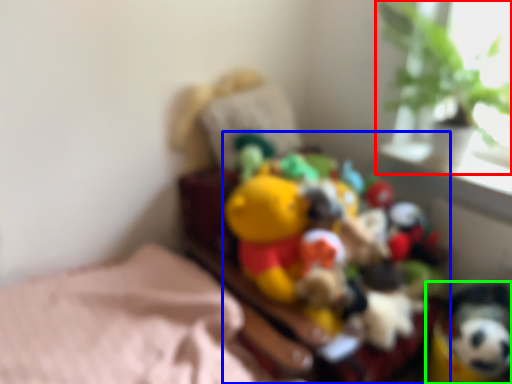
Question: Considering the real-world distances, which object is closest to houseplant (highlighted by a red box)? toy (highlighted by a blue box) or toy (highlighted by a green box).

Choices:
 (A) toy
 (B) toy

Answer: (A)